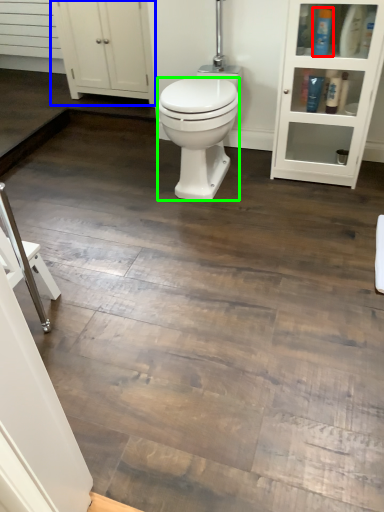
Question: Based on their relative distances, which object is farther from toiletry (highlighted by a red box)? Choose from cabinetry (highlighted by a blue box) and bidet (highlighted by a green box).

Choices:
 (A) cabinetry
 (B) bidet

Answer: (A)